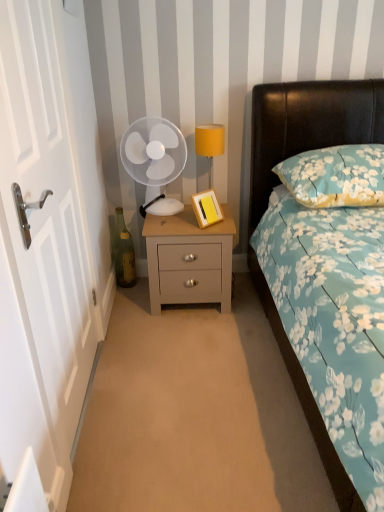
Locate an element on the screen. This screenshot has height=512, width=384. vacant space to the right of white wooden door at left is located at coordinates (177, 405).